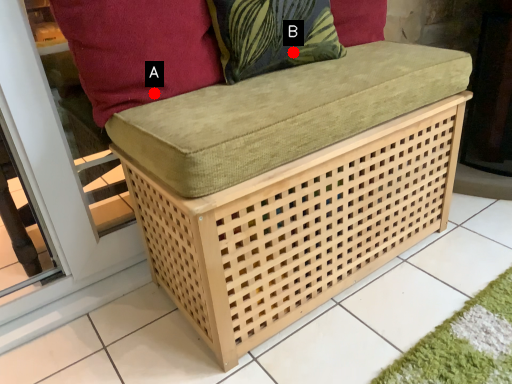
Question: Two points are circled on the image, labeled by A and B beside each circle. Which point is closer to the camera?

Choices:
 (A) A is closer
 (B) B is closer

Answer: (A)